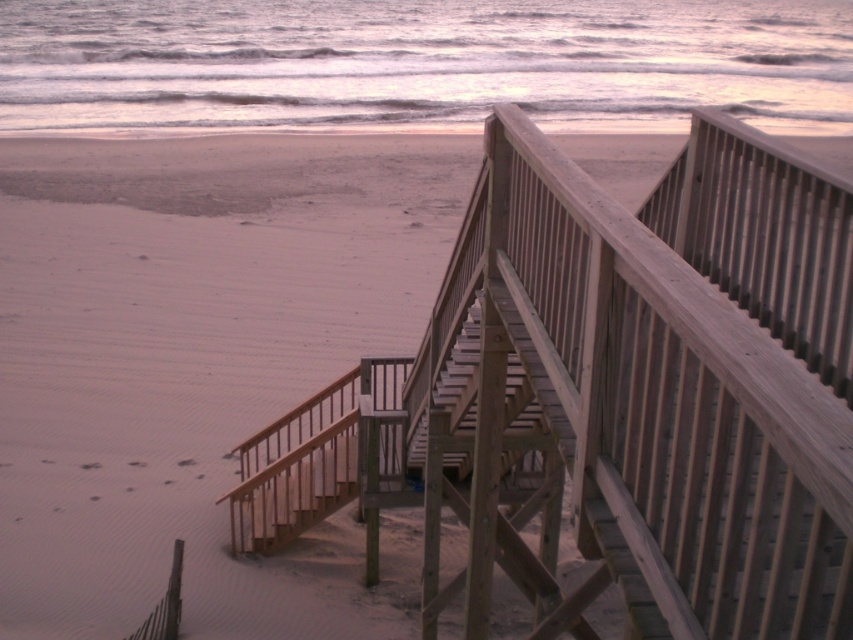
Which is below, sandy water at upper center or wooden stairs at center?

wooden stairs at center

Is sandy water at upper center thinner than wooden stairs at center?

No.

Is point (834, 12) more distant than point (521, 380)?

Yes.

You are a GUI agent. You are given a task and a screenshot of the screen. Output one action in this format:
    pyautogui.click(x=<x>, y=<y>)
    Task: Click on the sandy water at upper center
    This screenshot has height=640, width=853.
    Given the screenshot: What is the action you would take?
    pyautogui.click(x=421, y=64)